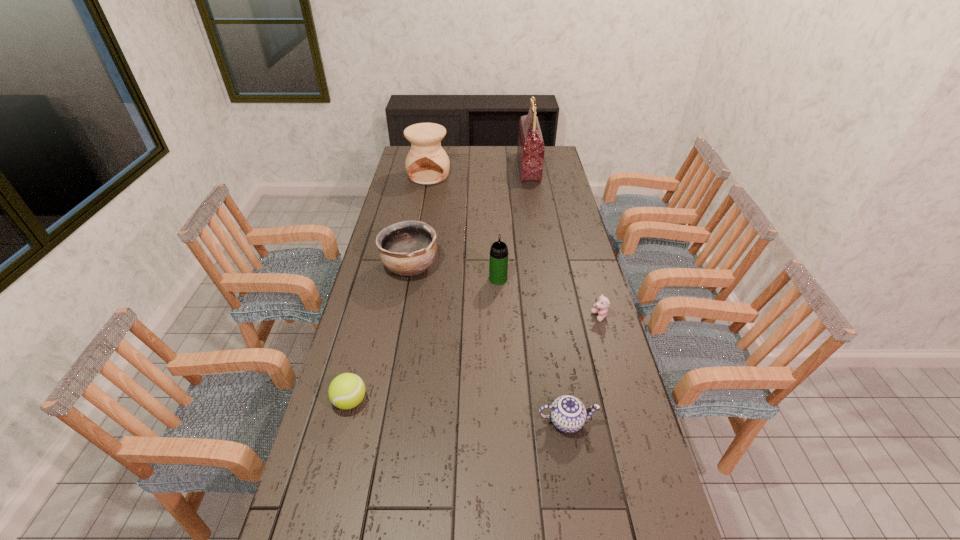
Where is `handbag`? The height and width of the screenshot is (540, 960). handbag is located at coordinates (530, 150).

This screenshot has width=960, height=540. What are the coordinates of `the sixth shortest object` in the screenshot? It's located at (427, 163).

Locate an element on the screen. Image resolution: width=960 pixels, height=540 pixels. the taller pottery is located at coordinates (x=427, y=163).

Identify the location of the fourth object from left to right. (498, 264).

Where is `the fifth shortest object`? the fifth shortest object is located at coordinates (498, 264).

Where is `the nearer pottery`? The width and height of the screenshot is (960, 540). the nearer pottery is located at coordinates (408, 248).

What are the coordinates of `the shorter pottery` in the screenshot? It's located at (408, 248).

Where is `tennis ball`? The height and width of the screenshot is (540, 960). tennis ball is located at coordinates (347, 390).

Locate an element on the screen. The height and width of the screenshot is (540, 960). chinaware is located at coordinates (568, 414).

The height and width of the screenshot is (540, 960). In order to click on teddy bear in this screenshot , I will do `click(601, 307)`.